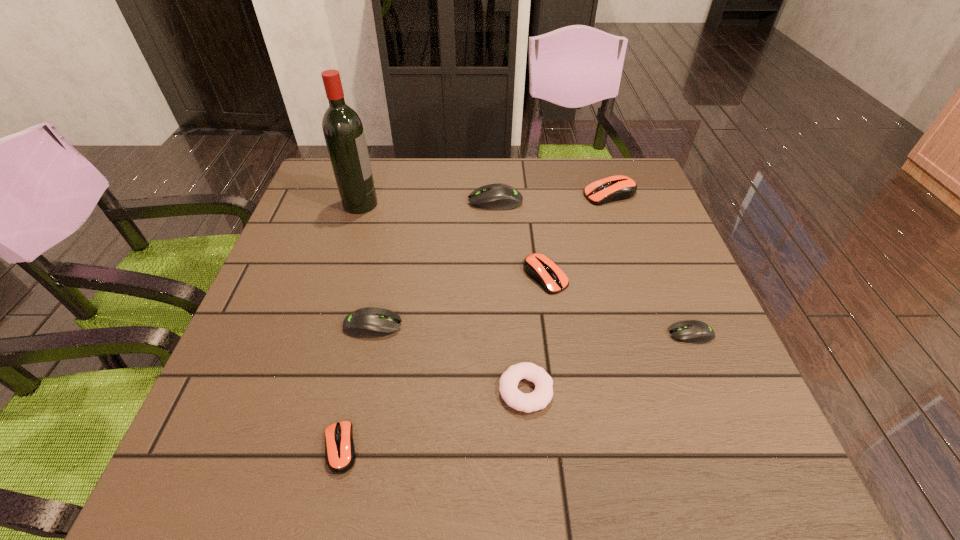
Locate an element on the screen. vacant point located between the doughnut and the leftmost gray computer mouse is located at coordinates (449, 358).

Where is `vacant area that lies between the second gray computer mouse from left to right and the second nearest object`? vacant area that lies between the second gray computer mouse from left to right and the second nearest object is located at coordinates (511, 296).

Where is `free space between the biggest orange computer mouse and the second farthest orange computer mouse`? The width and height of the screenshot is (960, 540). free space between the biggest orange computer mouse and the second farthest orange computer mouse is located at coordinates (578, 235).

Identify the location of vacant area that lies between the tallest object and the doughnut. (444, 297).

I want to click on free spot between the second biggest gray computer mouse and the farthest orange computer mouse, so click(492, 260).

At what (x,y) coordinates should I click in order to perform the action: click on object that stands as the closest to the smallest gray computer mouse. Please return your answer as a coordinate pair (x, y). The width and height of the screenshot is (960, 540). Looking at the image, I should click on (542, 269).

Where is `object that is the closest to the red wine bottle`? The width and height of the screenshot is (960, 540). object that is the closest to the red wine bottle is located at coordinates (498, 196).

Image resolution: width=960 pixels, height=540 pixels. I want to click on computer mouse identified as the third closest to the second farthest orange computer mouse, so click(615, 188).

This screenshot has height=540, width=960. Identify the location of computer mouse that stands as the closest to the second gray computer mouse from left to right. (615, 188).

This screenshot has height=540, width=960. I want to click on gray computer mouse that is the second closest to the doughnut, so click(690, 331).